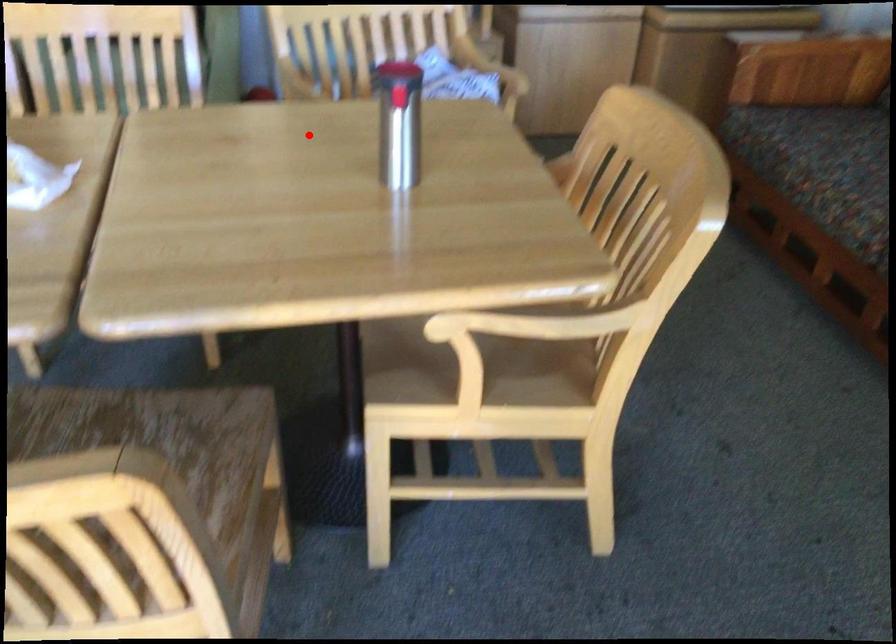
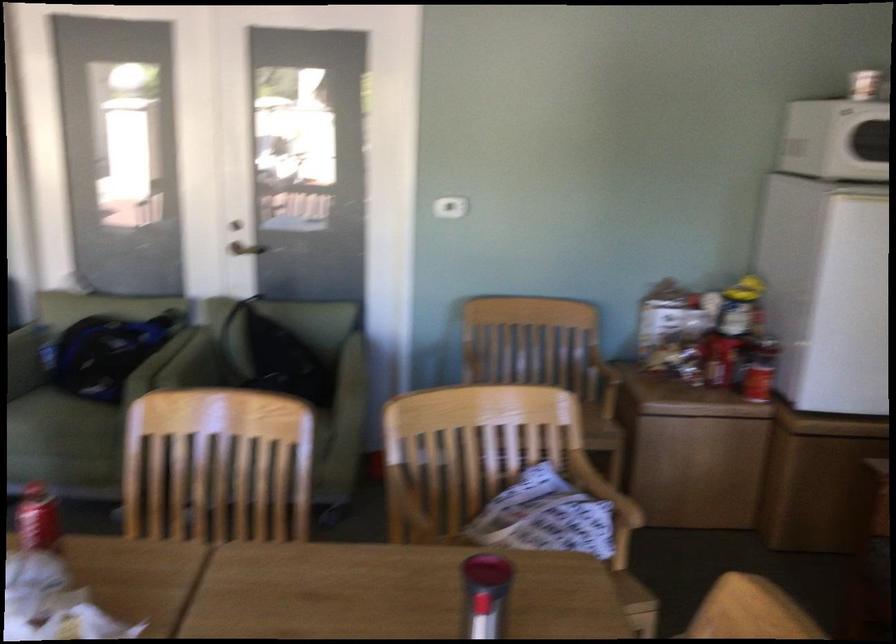
Find the pixel in the second image that matches the highlighted location in the first image.

(391, 592)